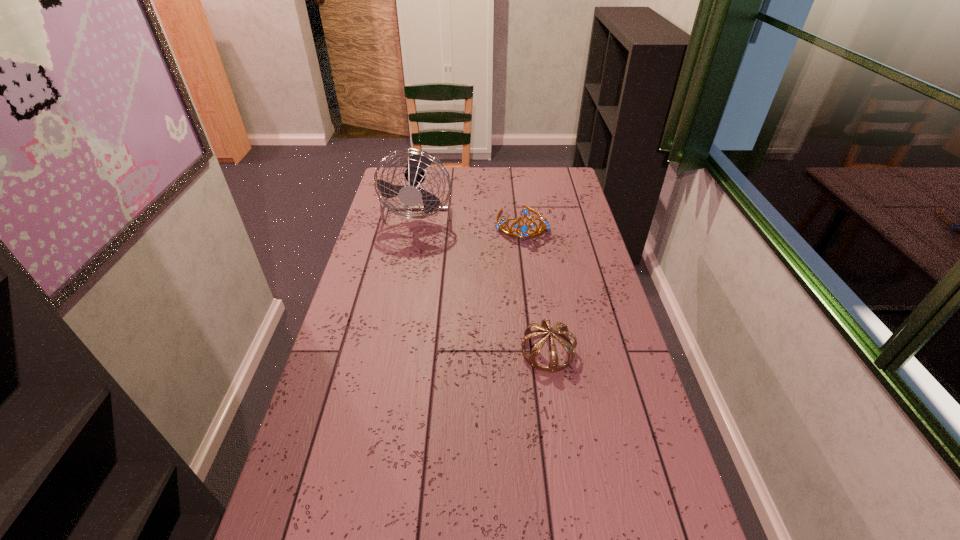
Find the location of `object at the left edge`. object at the left edge is located at coordinates (411, 195).

Find the location of a particular element. object that is at the far left corner is located at coordinates 411,195.

In the image, there is a desktop. At what (x,y) coordinates should I click in order to perform the action: click on vacant space at the far edge. Please return your answer as a coordinate pair (x, y). The image size is (960, 540). Looking at the image, I should click on (426, 178).

Where is `free region at the left edge of the desktop`? free region at the left edge of the desktop is located at coordinates (376, 306).

Find the location of a particular element. vacant space at the right edge of the desktop is located at coordinates (591, 369).

You are a GUI agent. You are given a task and a screenshot of the screen. Output one action in this format:
    pyautogui.click(x=<x>, y=<y>)
    Task: Click on the vacant space at the far right corner of the desktop
    The height and width of the screenshot is (540, 960).
    Given the screenshot: What is the action you would take?
    pyautogui.click(x=540, y=170)

Where is `free spot between the farther tiara and the nearer tiara`? free spot between the farther tiara and the nearer tiara is located at coordinates (535, 287).

Where is `free space between the leftmost object and the shorter tiara`? The image size is (960, 540). free space between the leftmost object and the shorter tiara is located at coordinates (x=484, y=279).

The height and width of the screenshot is (540, 960). In order to click on free area in between the nearer tiara and the leftmost object in this screenshot , I will do `click(484, 279)`.

Locate an element on the screen. This screenshot has width=960, height=540. vacant space that is in between the nearest object and the farther tiara is located at coordinates (535, 287).